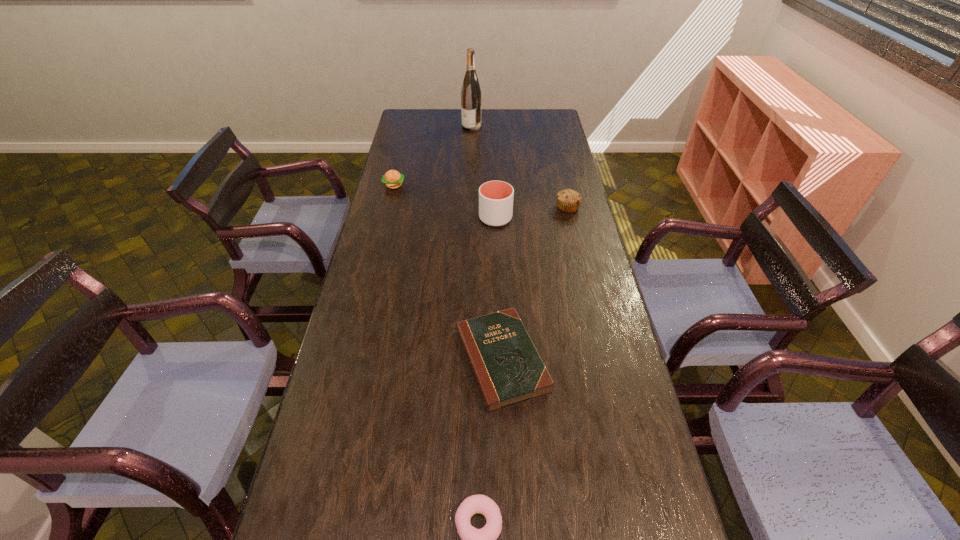
Identify the location of free spot located on the back of the hamburger. (406, 136).

The height and width of the screenshot is (540, 960). Find the location of `vacant space located 0.190m on the back of the second nearest object`. vacant space located 0.190m on the back of the second nearest object is located at coordinates (x=498, y=273).

Locate an element on the screen. The height and width of the screenshot is (540, 960). object at the far edge is located at coordinates (471, 93).

I want to click on object at the left edge, so click(x=393, y=179).

Find the location of a particular element. The width and height of the screenshot is (960, 540). object that is at the right edge is located at coordinates (568, 200).

In the image, there is a desktop. Where is `vacant space at the far edge`? vacant space at the far edge is located at coordinates (482, 114).

Identify the location of vacant region at the left edge of the desktop. (381, 234).

Find the location of a particular element. vacant space at the right edge of the desktop is located at coordinates (617, 442).

At what (x,y) coordinates should I click in order to perform the action: click on vacant space that's between the cup and the second farthest object. Please return your answer as a coordinate pair (x, y). The image size is (960, 540). Looking at the image, I should click on (444, 202).

I want to click on unoccupied position between the second nearest object and the fourth tallest object, so click(448, 273).